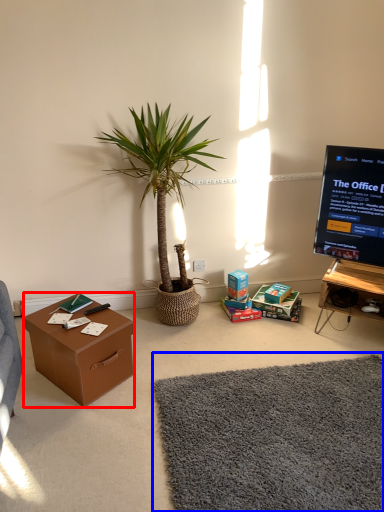
Question: Which object appears closest to the camera in this image, desk (highlighted by a red box) or plain (highlighted by a blue box)?

Choices:
 (A) desk
 (B) plain

Answer: (B)